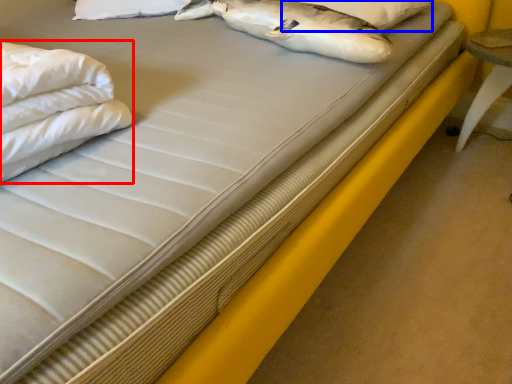
Question: Which of the following is the closest to the observer, sheet (highlighted by a red box) or pillow (highlighted by a blue box)?

Choices:
 (A) sheet
 (B) pillow

Answer: (A)